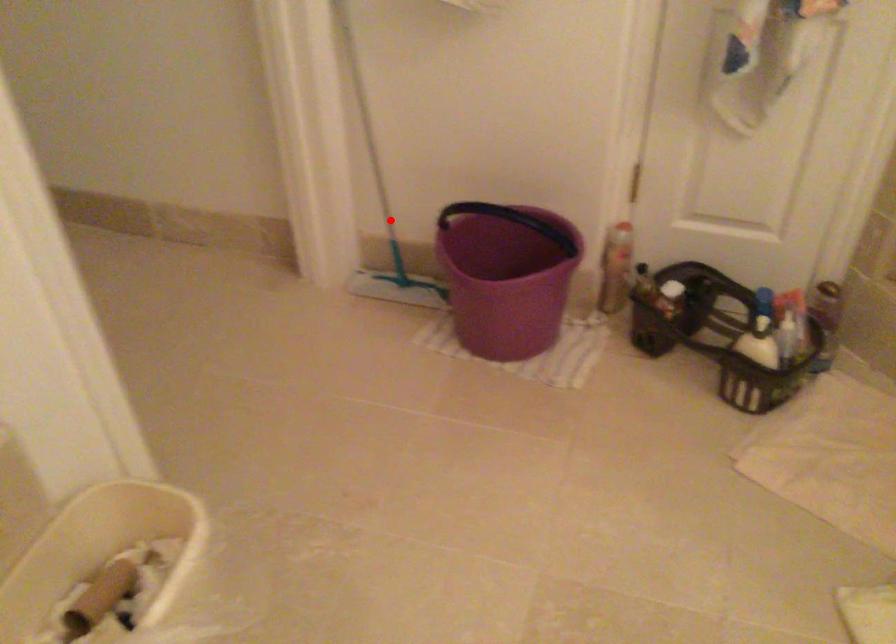
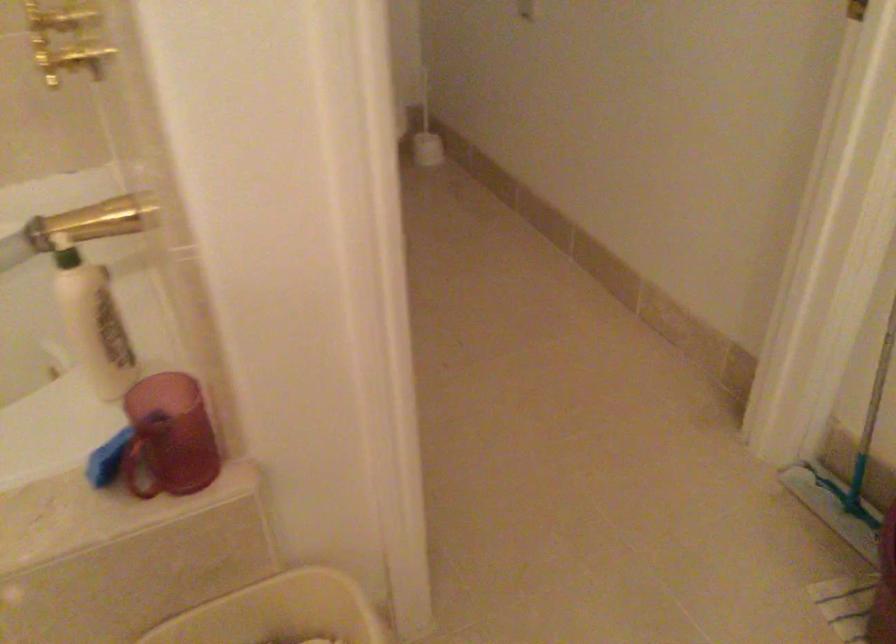
Question: I am providing you with two images of the same scene from different viewpoints. Image1 has a red point marked. In image2, the corresponding 3D location appears at what relative position? Reply with the corresponding letter.

Choices:
 (A) Closer
 (B) Farther

Answer: (A)